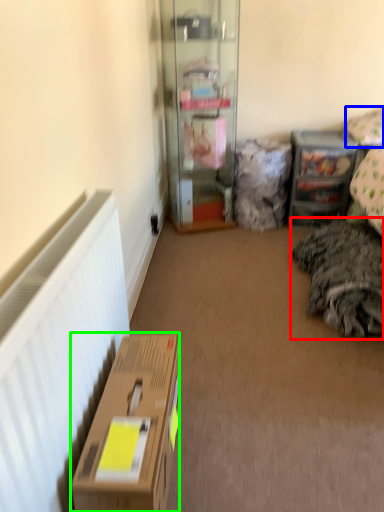
Question: Which is farther away from bedding (highlighted by a red box)? pillow (highlighted by a blue box) or box (highlighted by a green box)?

Choices:
 (A) pillow
 (B) box

Answer: (B)